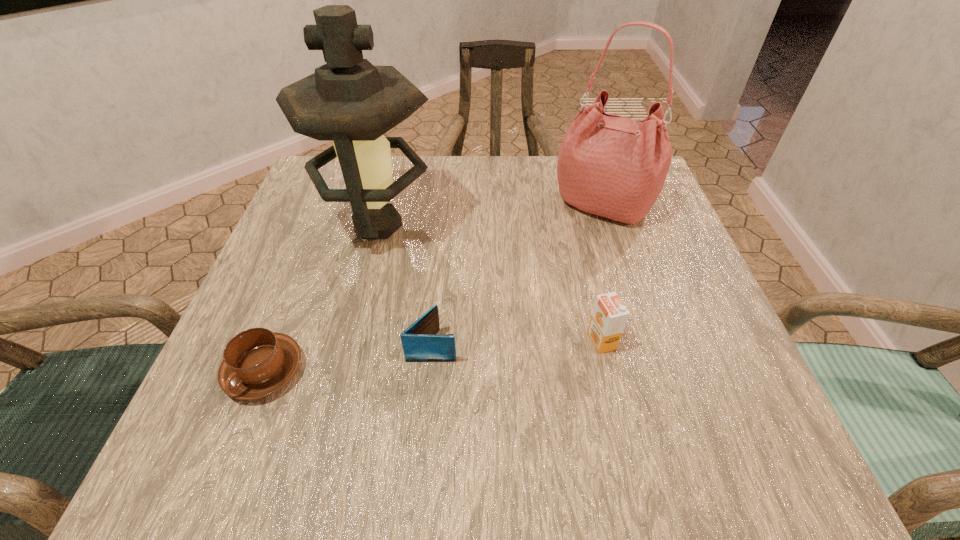
The width and height of the screenshot is (960, 540). I want to click on handbag situated at the far edge, so click(x=612, y=166).

Locate an element on the screen. This screenshot has height=540, width=960. oil lamp situated at the left edge is located at coordinates [349, 101].

Find the location of `cappuccino that is at the left edge`. cappuccino that is at the left edge is located at coordinates (257, 362).

Image resolution: width=960 pixels, height=540 pixels. In order to click on object that is at the right edge in this screenshot , I will do `click(612, 166)`.

Find the location of a particular element. The height and width of the screenshot is (540, 960). object at the far left corner is located at coordinates (349, 101).

At what (x,y) coordinates should I click in order to perform the action: click on object that is at the far right corner. Please return your answer as a coordinate pair (x, y). The height and width of the screenshot is (540, 960). Looking at the image, I should click on 612,166.

In the image, there is a desktop. Find the location of `free region at the far edge`. free region at the far edge is located at coordinates (404, 195).

At what (x,y) coordinates should I click in order to perform the action: click on vacant space at the near edge of the desktop. Please return your answer as a coordinate pair (x, y). The width and height of the screenshot is (960, 540). Looking at the image, I should click on (413, 413).

Find the location of a particular element. The width and height of the screenshot is (960, 540). vacant space at the left edge of the desktop is located at coordinates (359, 239).

In the image, there is a desktop. Where is `vacant space at the right edge`? Image resolution: width=960 pixels, height=540 pixels. vacant space at the right edge is located at coordinates (671, 335).